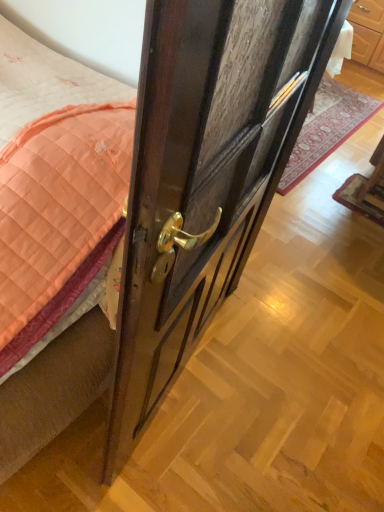
At what (x,y) coordinates should I click in order to perform the action: click on wooden door handle at center. Please return your answer as a coordinate pair (x, y). Looking at the image, I should click on (326, 129).

The height and width of the screenshot is (512, 384). What are the coordinates of `dark wood door at center` in the screenshot? It's located at (204, 174).

Considering the points (161, 369) and (283, 187), which point is in front, point (161, 369) or point (283, 187)?

The point (161, 369) is more forward.

From the image's perspective, which object appears higher, dark wood door at center or wooden door handle at center?

wooden door handle at center, from the image's perspective.

In the scene shown: How far apart are dark wood door at center and wooden door handle at center?

dark wood door at center is 4.98 feet from wooden door handle at center.

Which object is wider, dark wood door at center or wooden door handle at center?

Wider between the two is wooden door handle at center.

Which is more to the right, wooden chair at lower right or wooden door handle at center?

From the viewer's perspective, wooden chair at lower right appears more on the right side.

Who is taller, wooden chair at lower right or wooden door handle at center?

Standing taller between the two is wooden chair at lower right.

Considering the points (383, 195) and (357, 123), which point is in front, point (383, 195) or point (357, 123)?

The point (383, 195) is in front.

Is wooden chair at lower right positioned far away from dark wood door at center?

Yes, wooden chair at lower right is far from dark wood door at center.

Is wooden chair at lower right bigger than dark wood door at center?

Incorrect, wooden chair at lower right is not larger than dark wood door at center.

Is wooden chair at lower right situated inside dark wood door at center or outside?

wooden chair at lower right cannot be found inside dark wood door at center.

From a real-world perspective, is wooden chair at lower right above or below dark wood door at center?

From a real-world perspective, wooden chair at lower right is physically below dark wood door at center.

Based on the photo, is wooden door handle at center spatially inside dark wood door at center, or outside of it?

wooden door handle at center is located beyond the bounds of dark wood door at center.

Who is taller, wooden door handle at center or dark wood door at center?

dark wood door at center.

From the image's perspective, which is below, wooden door handle at center or dark wood door at center?

dark wood door at center is shown below in the image.

Which object is further away from the camera taking this photo, wooden door handle at center or dark wood door at center?

wooden door handle at center.

Considering the sizes of objects wooden door handle at center and wooden chair at lower right in the image provided, who is thinner, wooden door handle at center or wooden chair at lower right?

With smaller width is wooden chair at lower right.

Does wooden door handle at center turn towards wooden chair at lower right?

No, wooden door handle at center is not facing towards wooden chair at lower right.

Does wooden door handle at center come in front of wooden chair at lower right?

No, wooden door handle at center is further to the viewer.

Is dark wood door at center facing towards wooden chair at lower right?

No, dark wood door at center is not turned towards wooden chair at lower right.

From the image's perspective, which is below, dark wood door at center or wooden chair at lower right?

dark wood door at center.

Which object is wider, dark wood door at center or wooden chair at lower right?

wooden chair at lower right is wider.

Is wooden chair at lower right completely or partially inside dark wood door at center?

No, wooden chair at lower right is not surrounded by dark wood door at center.

Locate an element on the screen. door in front of the wooden door handle at center is located at coordinates (204, 174).

Image resolution: width=384 pixels, height=512 pixels. There is a wooden door handle at center. What are the coordinates of `furniture above it (from a real-world perspective)` in the screenshot? It's located at (366, 189).

Estimate the real-world distances between objects in this image. Which object is further from wooden chair at lower right, wooden door handle at center or dark wood door at center?

Among the two, dark wood door at center is located further to wooden chair at lower right.

Consider the image. Looking at the image, which one is located closer to wooden chair at lower right, dark wood door at center or wooden door handle at center?

wooden door handle at center.

Estimate the real-world distances between objects in this image. Which object is further from dark wood door at center, wooden door handle at center or wooden chair at lower right?

wooden door handle at center lies further to dark wood door at center than the other object.

Considering their positions, is dark wood door at center positioned closer to wooden door handle at center than wooden chair at lower right?

Based on the image, wooden chair at lower right appears to be nearer to wooden door handle at center.

Based on their spatial positions, is wooden chair at lower right or wooden door handle at center closer to dark wood door at center?

Among the two, wooden chair at lower right is located nearer to dark wood door at center.

From the image, which object appears to be farther from wooden door handle at center, wooden chair at lower right or dark wood door at center?

Based on the image, dark wood door at center appears to be further to wooden door handle at center.

Where is `furniture between dark wood door at center and wooden door handle at center in the front-back direction`? The image size is (384, 512). furniture between dark wood door at center and wooden door handle at center in the front-back direction is located at coordinates (366, 189).